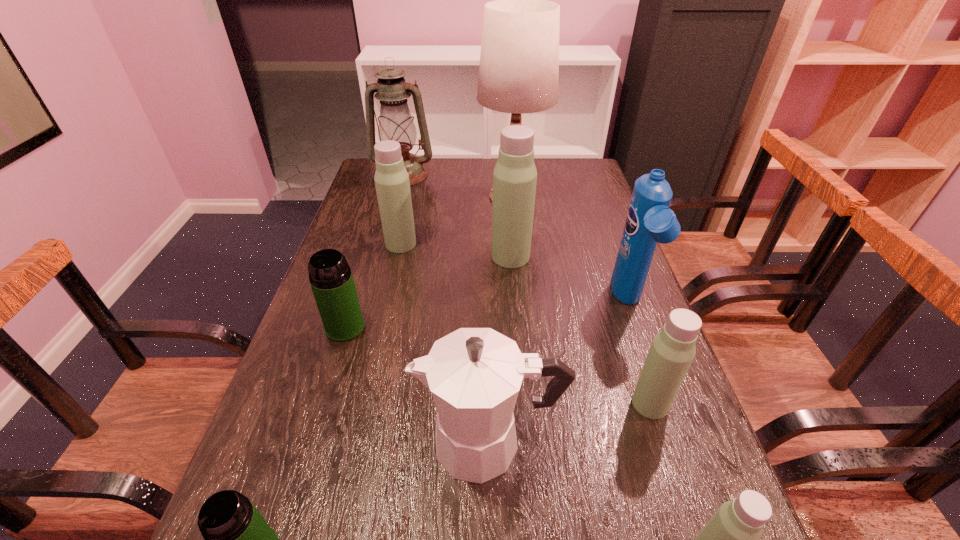
The image size is (960, 540). Identify the location of free space located from the spout of the farther green thermos bottle. (325, 391).

Where is `free location located on the left of the third biggest light thermos bottle`? The height and width of the screenshot is (540, 960). free location located on the left of the third biggest light thermos bottle is located at coordinates (491, 403).

You are a GUI agent. You are given a task and a screenshot of the screen. Output one action in this format:
    pyautogui.click(x=<x>, y=<y>)
    Task: Click on the lamp that is at the far edge
    The width and height of the screenshot is (960, 540).
    Given the screenshot: What is the action you would take?
    pyautogui.click(x=519, y=62)

Find the location of a particular element. oil lamp present at the far edge is located at coordinates (395, 123).

Image resolution: width=960 pixels, height=540 pixels. I want to click on oil lamp that is positioned at the left edge, so click(x=395, y=123).

At what (x,y) coordinates should I click in order to perform the action: click on shampoo present at the right edge. Please return your answer as a coordinate pair (x, y). Looking at the image, I should click on (649, 220).

You are a GUI agent. You are given a task and a screenshot of the screen. Output one action in this format:
    pyautogui.click(x=<x>, y=<y>)
    Task: Click on the thermos bottle at the right edge
    The image size is (960, 540).
    Given the screenshot: What is the action you would take?
    pyautogui.click(x=672, y=351)

I want to click on object at the far left corner, so click(x=395, y=123).

Locate an element on the screen. The height and width of the screenshot is (540, 960). vacant space at the far edge is located at coordinates (469, 174).

I want to click on free space at the left edge of the desktop, so click(375, 208).